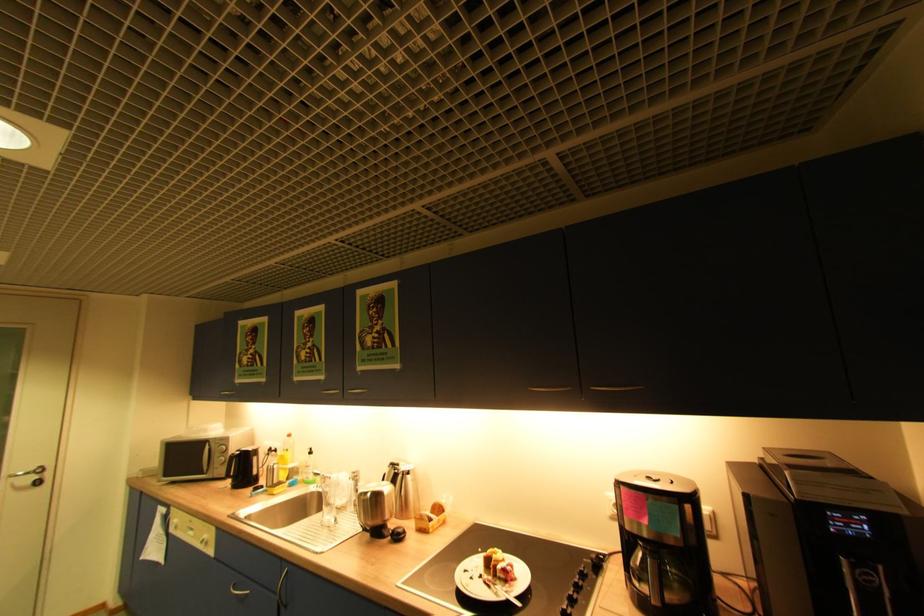
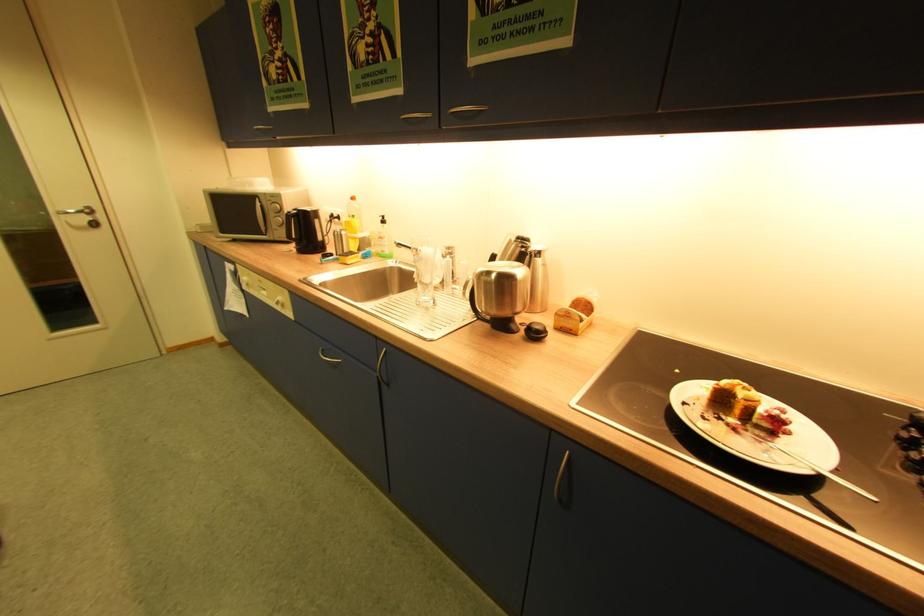
Find the pixel in the second image that matches point 282,468 in the first image.

(348, 233)